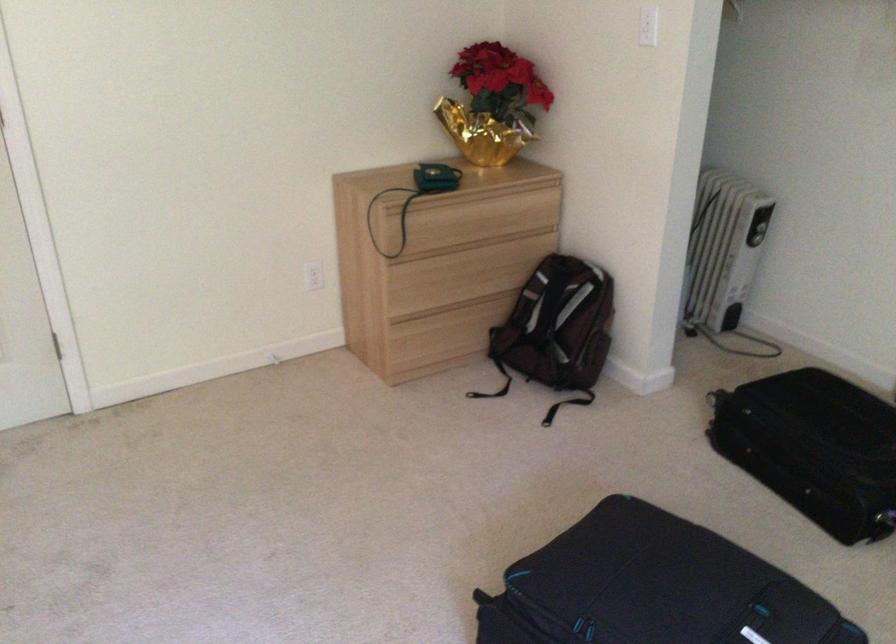
Where is `backpack top handle`? The width and height of the screenshot is (896, 644). backpack top handle is located at coordinates (558, 272).